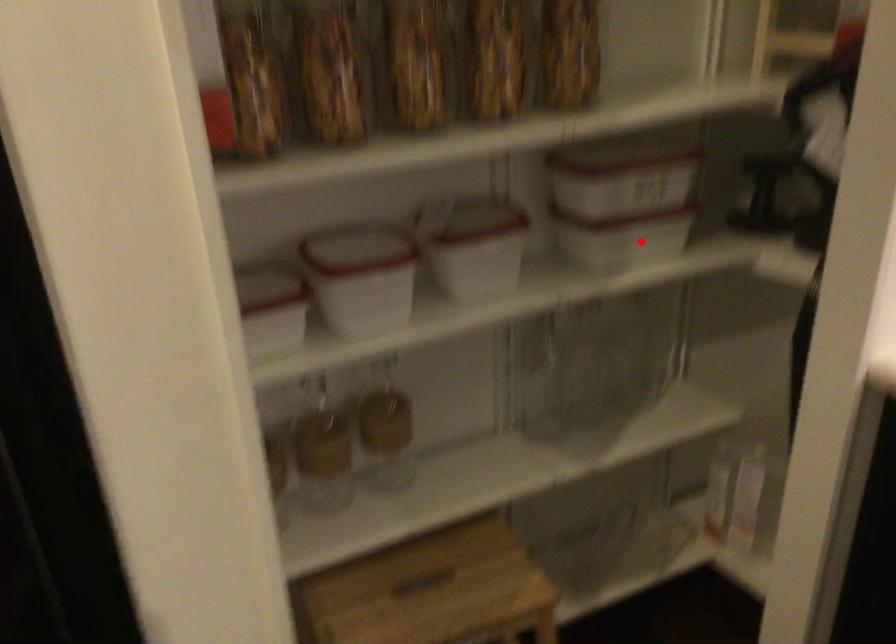
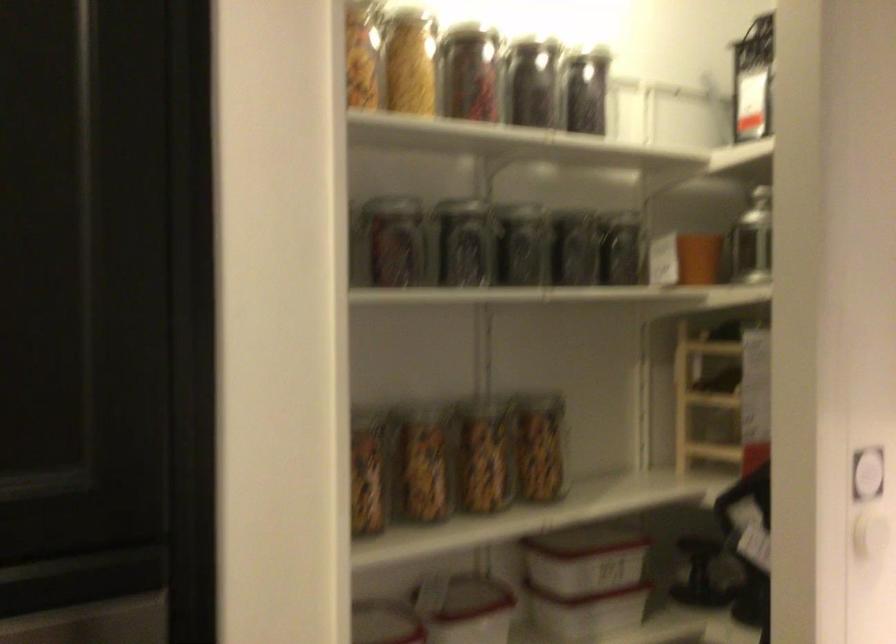
Locate, in the second image, the point that corresponds to the highlighted location in the first image.

(607, 614)